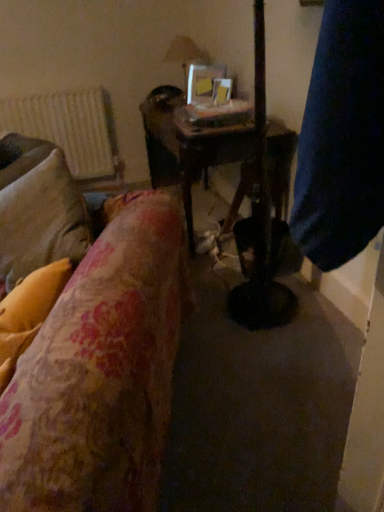
What is the approximate width of floral fabric pillow at left?

floral fabric pillow at left is 11.64 inches in width.

Locate an element on the screen. white textured radiator at upper left is located at coordinates (67, 128).

The width and height of the screenshot is (384, 512). What do you see at coordinates (67, 128) in the screenshot?
I see `white textured radiator at upper left` at bounding box center [67, 128].

This screenshot has height=512, width=384. What are the coordinates of `wooden table at center` in the screenshot? It's located at (211, 154).

The image size is (384, 512). What are the coordinates of `floral fabric pillow at left` in the screenshot? It's located at (28, 312).

Would you say white textured radiator at upper left is outside floral fabric pillow at left?

Yes, white textured radiator at upper left is not within floral fabric pillow at left.

Between white textured radiator at upper left and floral fabric pillow at left, which one has more height?

Standing taller between the two is white textured radiator at upper left.

From the image's perspective, is white textured radiator at upper left positioned above or below floral fabric pillow at left?

white textured radiator at upper left is situated higher than floral fabric pillow at left in the image.

In the scene shown: Can you confirm if clear glass lampshade at upper center is wider than wooden table at center?

Incorrect, the width of clear glass lampshade at upper center does not surpass that of wooden table at center.

From the image's perspective, between clear glass lampshade at upper center and wooden table at center, who is located below?

wooden table at center is shown below in the image.

Who is bigger, clear glass lampshade at upper center or wooden table at center?

wooden table at center.

Which is in front, clear glass lampshade at upper center or wooden table at center?

wooden table at center is in front.

Where is `table lamp located behind the wooden table at center`? This screenshot has height=512, width=384. table lamp located behind the wooden table at center is located at coordinates (186, 54).

Measure the distance from wooden table at center to clear glass lampshade at upper center.

3.50 feet.

How different are the orientations of wooden table at center and clear glass lampshade at upper center in degrees?

The facing directions of wooden table at center and clear glass lampshade at upper center are 0.000758 degrees apart.

Could you tell me if wooden table at center is facing clear glass lampshade at upper center?

No, wooden table at center is not aimed at clear glass lampshade at upper center.

Which object is thinner, floral fabric pillow at left or white textured radiator at upper left?

With smaller width is white textured radiator at upper left.

From a real-world perspective, is floral fabric pillow at left positioned under white textured radiator at upper left based on gravity?

No, from a real-world perspective, floral fabric pillow at left is not beneath white textured radiator at upper left.

Which of these two, floral fabric pillow at left or white textured radiator at upper left, stands shorter?

With less height is floral fabric pillow at left.

How distant is floral fabric pillow at left from white textured radiator at upper left?

floral fabric pillow at left is 7.55 feet from white textured radiator at upper left.

Considering the relative sizes of wooden table at center and floral fabric pillow at left in the image provided, is wooden table at center taller than floral fabric pillow at left?

Yes.

Which object is positioned more to the left, wooden table at center or floral fabric pillow at left?

floral fabric pillow at left is more to the left.

Which is behind, point (230, 136) or point (58, 285)?

The point (230, 136) is more distant.

Which object is closer to the camera taking this photo, white textured radiator at upper left or wooden table at center?

wooden table at center.

From a real-world perspective, is white textured radiator at upper left above or below wooden table at center?

white textured radiator at upper left is above wooden table at center.

Looking at this image, considering the sizes of objects white textured radiator at upper left and wooden table at center in the image provided, who is wider, white textured radiator at upper left or wooden table at center?

wooden table at center is wider.

Considering the sizes of objects white textured radiator at upper left and wooden table at center in the image provided, who is smaller, white textured radiator at upper left or wooden table at center?

white textured radiator at upper left.

Is floral fabric pillow at left positioned with its back to wooden table at center?

floral fabric pillow at left does not have its back to wooden table at center.

Does point (15, 300) appear closer or farther from the camera than point (244, 126)?

Clearly, point (15, 300) is closer to the camera than point (244, 126).

Based on their sizes in the image, would you say floral fabric pillow at left is bigger or smaller than wooden table at center?

floral fabric pillow at left is smaller than wooden table at center.

At what (x,y) coordinates should I click in order to perform the action: click on radiator on the left of the floral fabric pillow at left. Please return your answer as a coordinate pair (x, y). The image size is (384, 512). Looking at the image, I should click on (67, 128).

Where is `table lamp behind the wooden table at center`? The height and width of the screenshot is (512, 384). table lamp behind the wooden table at center is located at coordinates (186, 54).

Based on their spatial positions, is wooden table at center or white textured radiator at upper left closer to clear glass lampshade at upper center?

The object closer to clear glass lampshade at upper center is white textured radiator at upper left.

Looking at the image, which one is located closer to white textured radiator at upper left, clear glass lampshade at upper center or floral fabric pillow at left?

Based on the image, clear glass lampshade at upper center appears to be nearer to white textured radiator at upper left.

From the image, which object appears to be nearer to wooden table at center, floral fabric pillow at left or white textured radiator at upper left?

floral fabric pillow at left lies closer to wooden table at center than the other object.

From the image, which object appears to be farther from wooden table at center, white textured radiator at upper left or floral fabric pillow at left?

Among the two, white textured radiator at upper left is located further to wooden table at center.

Estimate the real-world distances between objects in this image. Which object is closer to wooden table at center, floral fabric pillow at left or clear glass lampshade at upper center?

Among the two, clear glass lampshade at upper center is located nearer to wooden table at center.

From the image, which object appears to be farther from white textured radiator at upper left, floral fabric pillow at left or wooden table at center?

floral fabric pillow at left is positioned further to the anchor white textured radiator at upper left.

From the image, which object appears to be nearer to clear glass lampshade at upper center, white textured radiator at upper left or floral fabric pillow at left?

white textured radiator at upper left lies closer to clear glass lampshade at upper center than the other object.

From the image, which object appears to be nearer to white textured radiator at upper left, clear glass lampshade at upper center or wooden table at center?

Among the two, clear glass lampshade at upper center is located nearer to white textured radiator at upper left.

Locate an element on the screen. table located between floral fabric pillow at left and clear glass lampshade at upper center in the depth direction is located at coordinates (211, 154).

Locate an element on the screen. The image size is (384, 512). table between floral fabric pillow at left and white textured radiator at upper left along the z-axis is located at coordinates (211, 154).

Identify the location of table lamp between floral fabric pillow at left and white textured radiator at upper left along the z-axis. The width and height of the screenshot is (384, 512). (186, 54).

Where is `table lamp located between white textured radiator at upper left and wooden table at center in the left-right direction`? Image resolution: width=384 pixels, height=512 pixels. table lamp located between white textured radiator at upper left and wooden table at center in the left-right direction is located at coordinates (186, 54).